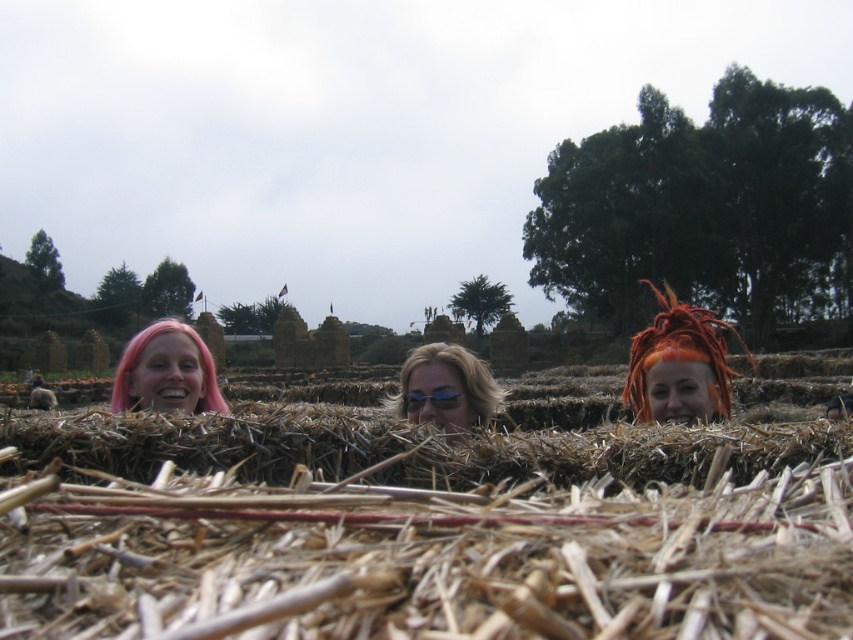
You are a photographer trying to capture a closeup of the sunglasses at center and orange dreadlocks at center in the image. Which object should you zoom in on to ensure both are in frame without moving the camera?

You should zoom in on the orange dreadlocks at center because its width is greater than the sunglasses at center, ensuring both fit within the frame when centered.